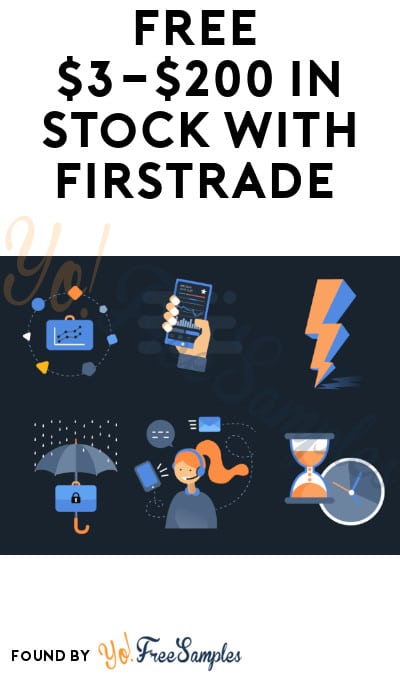
The height and width of the screenshot is (675, 400). I want to click on phone, so click(x=192, y=306), click(x=149, y=479).